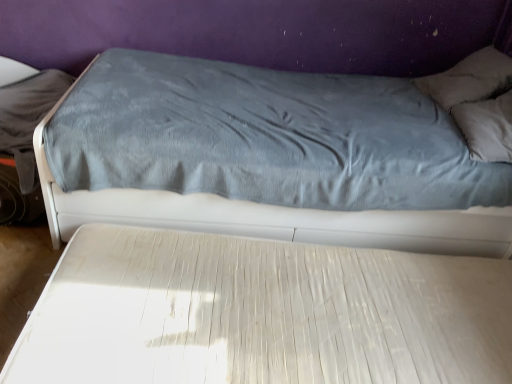
Question: From a real-world perspective, does white textured mattress at center, the first bed from the bottom, sit lower than gray soft pillow at upper right?

Choices:
 (A) no
 (B) yes

Answer: (B)

Question: From a real-world perspective, is white textured mattress at center, which is counted as the 2th bed, starting from the top, positioned over gray soft pillow at upper right based on gravity?

Choices:
 (A) yes
 (B) no

Answer: (B)

Question: Considering the relative sizes of white textured mattress at center, the first bed from the bottom, and gray soft pillow at upper right in the image provided, is white textured mattress at center, the first bed from the bottom, smaller than gray soft pillow at upper right?

Choices:
 (A) yes
 (B) no

Answer: (B)

Question: Is white textured mattress at center, the first bed from the bottom, positioned in front of gray soft pillow at upper right?

Choices:
 (A) no
 (B) yes

Answer: (B)

Question: Does white textured mattress at center, the first bed from the bottom, appear on the right side of gray soft pillow at upper right?

Choices:
 (A) no
 (B) yes

Answer: (A)

Question: Is white textured mattress at center, the first bed from the bottom, shorter than gray soft pillow at upper right?

Choices:
 (A) no
 (B) yes

Answer: (B)

Question: Can you confirm if gray soft pillow at upper right is shorter than velvet blue bed at upper center, the 2th bed positioned from the bottom?

Choices:
 (A) no
 (B) yes

Answer: (B)

Question: Are gray soft pillow at upper right and velvet blue bed at upper center, placed as the first bed when sorted from top to bottom, located far from each other?

Choices:
 (A) no
 (B) yes

Answer: (A)

Question: Is velvet blue bed at upper center, the 2th bed positioned from the bottom, at the back of gray soft pillow at upper right?

Choices:
 (A) no
 (B) yes

Answer: (B)

Question: Is the depth of gray soft pillow at upper right less than that of velvet blue bed at upper center, the 2th bed positioned from the bottom?

Choices:
 (A) no
 (B) yes

Answer: (A)

Question: Is gray soft pillow at upper right to the left of velvet blue bed at upper center, placed as the first bed when sorted from top to bottom, from the viewer's perspective?

Choices:
 (A) no
 (B) yes

Answer: (A)

Question: Is velvet blue bed at upper center, the 2th bed positioned from the bottom, completely or partially inside gray soft pillow at upper right?

Choices:
 (A) yes
 (B) no

Answer: (B)

Question: Is gray soft pillow at upper right wider than white textured mattress at center, the first bed from the bottom?

Choices:
 (A) no
 (B) yes

Answer: (A)